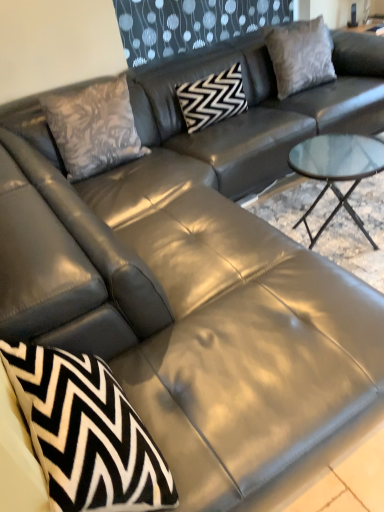
Question: Which direction should I rotate to look at black zigzag-patterned pillow at center, arranged as the 1th pillow when viewed from the left?

Choices:
 (A) left
 (B) right

Answer: (B)

Question: Is black and white zigzag pillow at lower left, which is the first throw pillow in bottom-to-top order, facing towards suede gray pillow at upper right, the 1th pillow in the right-to-left sequence?

Choices:
 (A) no
 (B) yes

Answer: (A)

Question: Considering the relative sizes of black and white zigzag pillow at lower left, which ranks as the first throw pillow in front-to-back order, and suede gray pillow at upper right, marked as the second pillow in a left-to-right arrangement, in the image provided, is black and white zigzag pillow at lower left, which ranks as the first throw pillow in front-to-back order, shorter than suede gray pillow at upper right, marked as the second pillow in a left-to-right arrangement,?

Choices:
 (A) no
 (B) yes

Answer: (B)

Question: Is black and white zigzag pillow at lower left, which appears as the 2th throw pillow when viewed from the back, with suede gray pillow at upper right, marked as the second pillow in a left-to-right arrangement?

Choices:
 (A) yes
 (B) no

Answer: (B)

Question: Is black and white zigzag pillow at lower left, which appears as the 2th throw pillow when viewed from the back, positioned far away from suede gray pillow at upper right, the 1th pillow in the right-to-left sequence?

Choices:
 (A) yes
 (B) no

Answer: (A)

Question: From a real-world perspective, is black and white zigzag pillow at lower left, the second throw pillow from the top, positioned over suede gray pillow at upper right, the 1th pillow in the right-to-left sequence, based on gravity?

Choices:
 (A) yes
 (B) no

Answer: (B)

Question: Can you confirm if black and white zigzag pillow at lower left, which is the first throw pillow in bottom-to-top order, is taller than suede gray pillow at upper right, the 1th pillow in the right-to-left sequence?

Choices:
 (A) yes
 (B) no

Answer: (B)

Question: Is suede gray pillow at upper right, marked as the second pillow in a left-to-right arrangement, to the right of floral-patterned fabric pillow at upper left, which is the second throw pillow from front to back, from the viewer's perspective?

Choices:
 (A) yes
 (B) no

Answer: (A)

Question: Does suede gray pillow at upper right, marked as the second pillow in a left-to-right arrangement, have a greater width compared to floral-patterned fabric pillow at upper left, the 2th throw pillow in the bottom-to-top sequence?

Choices:
 (A) no
 (B) yes

Answer: (B)

Question: Is suede gray pillow at upper right, the 1th pillow in the right-to-left sequence, shorter than floral-patterned fabric pillow at upper left, the 2th throw pillow in the bottom-to-top sequence?

Choices:
 (A) yes
 (B) no

Answer: (A)

Question: Does suede gray pillow at upper right, marked as the second pillow in a left-to-right arrangement, have a larger size compared to floral-patterned fabric pillow at upper left, which ranks as the 1th throw pillow in top-to-bottom order?

Choices:
 (A) no
 (B) yes

Answer: (B)

Question: Is floral-patterned fabric pillow at upper left, which ranks as the 1th throw pillow in top-to-bottom order, surrounded by suede gray pillow at upper right, the 1th pillow in the right-to-left sequence?

Choices:
 (A) yes
 (B) no

Answer: (B)

Question: From the image's perspective, is suede gray pillow at upper right, the 1th pillow in the right-to-left sequence, below floral-patterned fabric pillow at upper left, which ranks as the 1th throw pillow in top-to-bottom order?

Choices:
 (A) yes
 (B) no

Answer: (B)

Question: Can you confirm if floral-patterned fabric pillow at upper left, which ranks as the 1th throw pillow in top-to-bottom order, is positioned to the left of black zigzag-patterned pillow at center, arranged as the 1th pillow when viewed from the left?

Choices:
 (A) yes
 (B) no

Answer: (A)